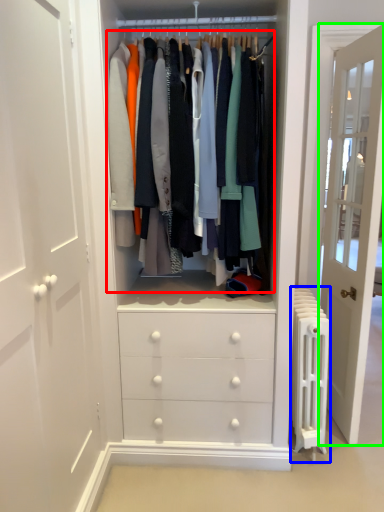
Question: Based on their relative distances, which object is nearer to closet (highlighted by a red box)? Choose from radiator (highlighted by a blue box) and door (highlighted by a green box).

Choices:
 (A) radiator
 (B) door

Answer: (A)